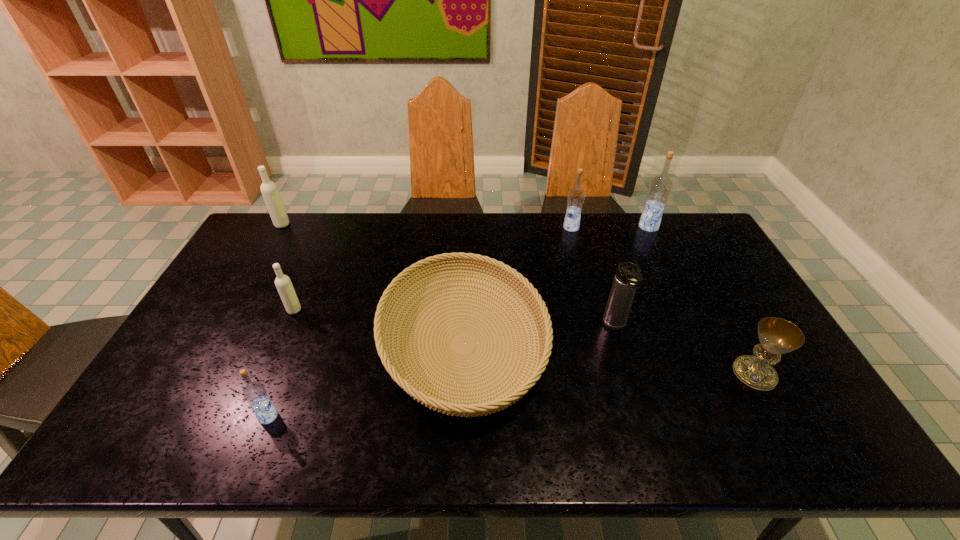
Locate an element on the screen. This screenshot has height=540, width=960. vacant space located on the left of the rightmost object is located at coordinates tap(688, 374).

Find the location of `free region located 0.250m on the right of the fourth object from left to right`. free region located 0.250m on the right of the fourth object from left to right is located at coordinates (637, 344).

I want to click on vodka that is at the near edge, so click(x=254, y=392).

At what (x,y) coordinates should I click in order to perform the action: click on basket that is at the near edge. Please return your answer as a coordinate pair (x, y). The image size is (960, 540). Looking at the image, I should click on (502, 398).

Locate an element on the screen. The width and height of the screenshot is (960, 540). object present at the left edge is located at coordinates (269, 190).

Identify the location of object that is at the right edge. (777, 336).

Locate an element on the screen. object at the far left corner is located at coordinates (269, 190).

In the image, there is a desktop. Where is `vacant space at the far edge`? This screenshot has height=540, width=960. vacant space at the far edge is located at coordinates (423, 248).

Locate an element on the screen. The height and width of the screenshot is (540, 960). vacant region at the near edge of the desktop is located at coordinates (292, 442).

I want to click on vacant space at the left edge of the desktop, so click(139, 406).